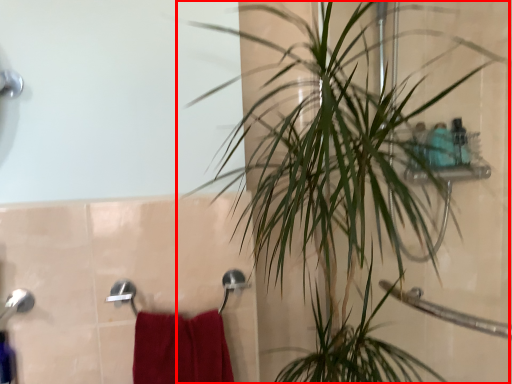
Question: From the image's perspective, where is houseplant (annotated by the red box) located in relation to bath towel in the image?

Choices:
 (A) above
 (B) below

Answer: (A)